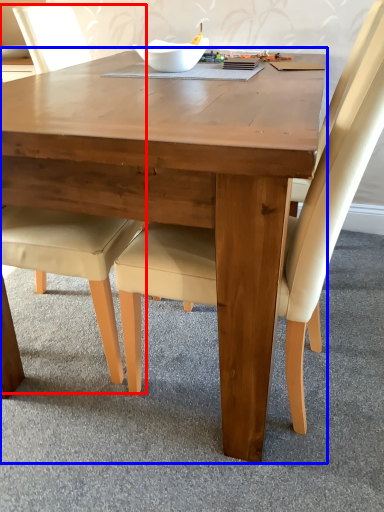
Question: Which point is closer to the camera, chair (highlighted by a red box) or coffee table (highlighted by a blue box)?

Choices:
 (A) chair
 (B) coffee table

Answer: (B)